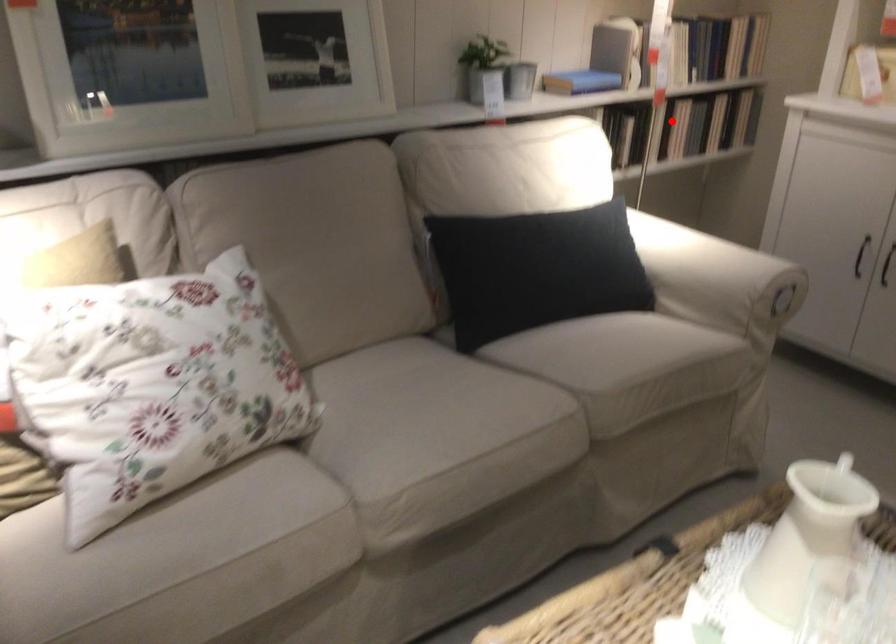
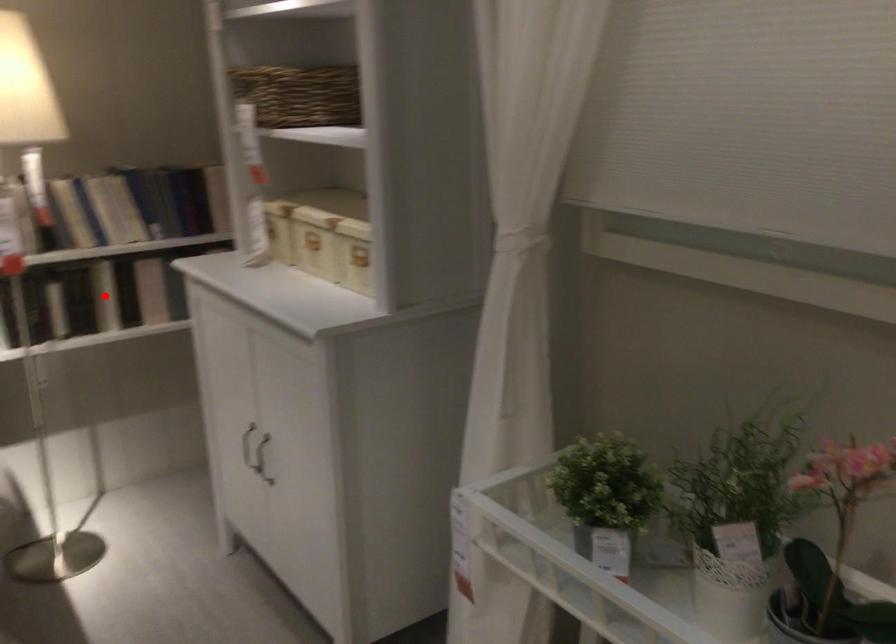
I am providing you with two images of the same scene from different viewpoints. A red point is marked on the first image and another point is marked on the second image. Is the red point in image1 aligned with the point shown in image2?

Yes